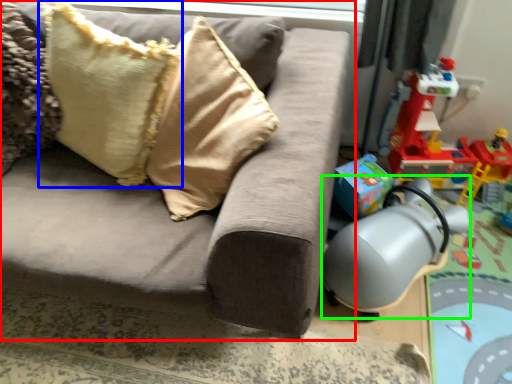
Question: Which object is positioned farthest from studio couch (highlighted by a red box)? Select from pillow (highlighted by a blue box) and swivel chair (highlighted by a green box).

Choices:
 (A) pillow
 (B) swivel chair

Answer: (B)